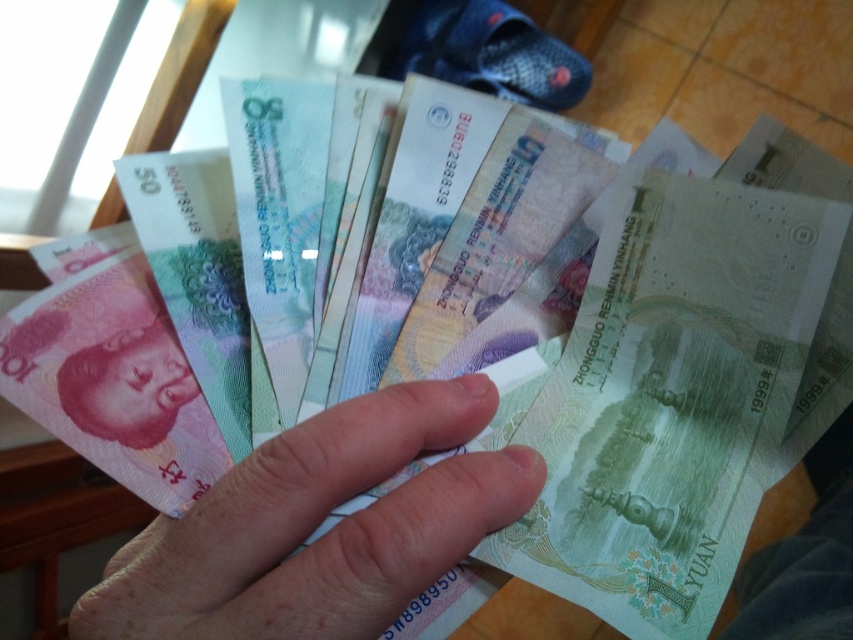
Does smooth skin hand at center have a lesser height compared to matte paper money at lower left?

Incorrect, smooth skin hand at center's height does not fall short of matte paper money at lower left's.

Which is above, smooth skin hand at center or matte paper money at lower left?

matte paper money at lower left

This screenshot has height=640, width=853. What are the coordinates of `smooth skin hand at center` in the screenshot? It's located at (318, 524).

The width and height of the screenshot is (853, 640). In order to click on smooth skin hand at center in this screenshot , I will do `click(318, 524)`.